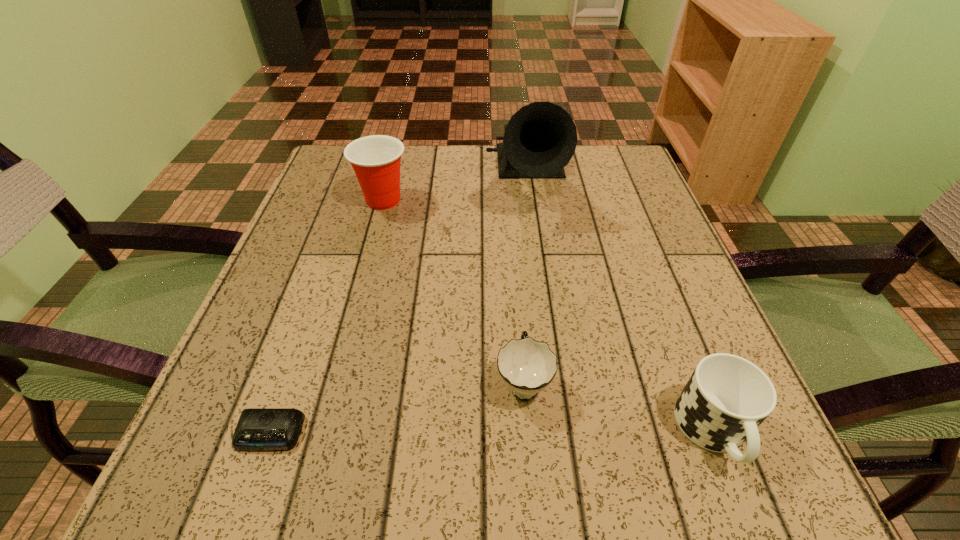
You are a GUI agent. You are given a task and a screenshot of the screen. Output one action in this format:
    pyautogui.click(x=<x>, y=<y>)
    Task: Click on the free spot located on the side of the shortest cup with the handle
    Image resolution: width=960 pixels, height=540 pixels.
    Given the screenshot: What is the action you would take?
    pyautogui.click(x=513, y=251)

Where is `vacant space located on the side of the shortest cup with the handle`? This screenshot has height=540, width=960. vacant space located on the side of the shortest cup with the handle is located at coordinates (516, 278).

Identify the location of vacant position located 0.130m on the side of the shortest cup with the handle. 516,289.

Where is `phonograph_record at the far edge`? The height and width of the screenshot is (540, 960). phonograph_record at the far edge is located at coordinates (540, 139).

Locate an element on the screen. cup that is positioned at the far edge is located at coordinates (376, 159).

What are the coordinates of `cup present at the near edge` in the screenshot? It's located at (727, 397).

You are a GUI agent. You are given a task and a screenshot of the screen. Output one action in this format:
    pyautogui.click(x=<x>, y=<y>)
    Task: Click on the alarm clock located at the near edge
    The width and height of the screenshot is (960, 540).
    Given the screenshot: What is the action you would take?
    pyautogui.click(x=258, y=429)

I want to click on cup present at the left edge, so click(x=376, y=159).

This screenshot has width=960, height=540. What are the coordinates of `alarm clock that is at the left edge` in the screenshot? It's located at (258, 429).

The height and width of the screenshot is (540, 960). What are the coordinates of `object that is positioned at the right edge` in the screenshot? It's located at (727, 397).